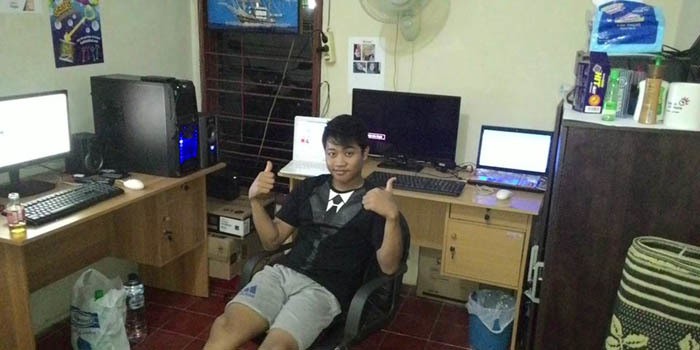
Where is `keyboard`? The width and height of the screenshot is (700, 350). keyboard is located at coordinates (50, 207).